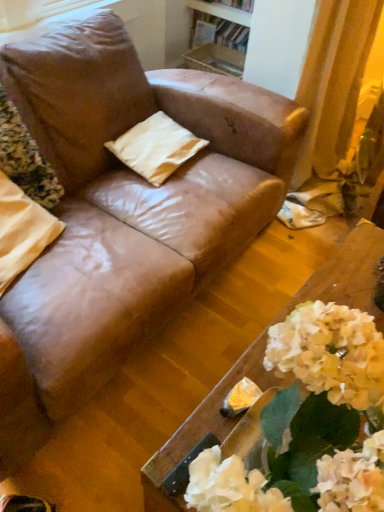
Where is `empty space that is ontop of wooden bookshelf at upper center (from a real-world perspective)`? Image resolution: width=384 pixels, height=512 pixels. empty space that is ontop of wooden bookshelf at upper center (from a real-world perspective) is located at coordinates (226, 13).